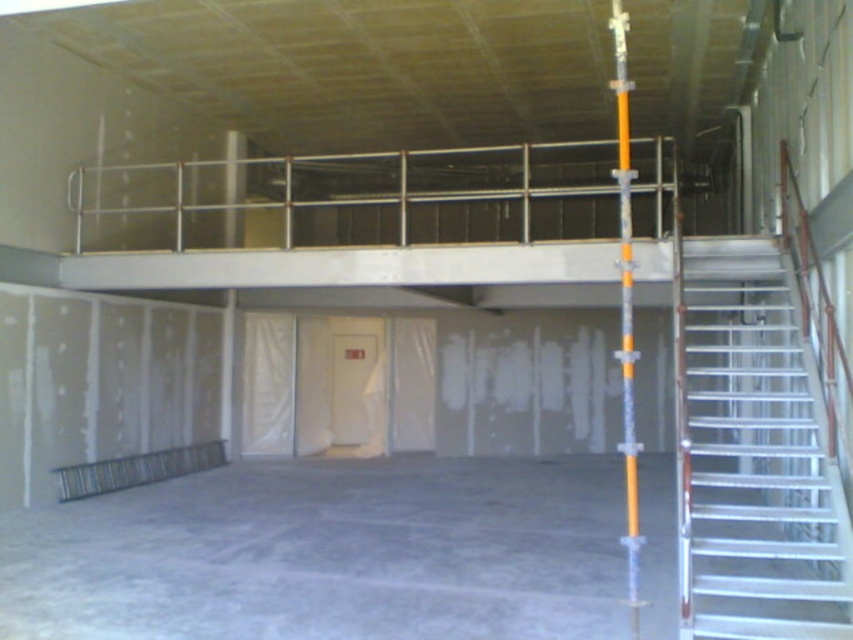
You are a construction worker carrying a heavy tool box and need to reach the second floor. You see the metallic silver staircase at right and the orange metallic pole at right. Which one should you use to climb safely?

You should use the metallic silver staircase at right to climb safely because it is positioned on the right side of the orange metallic pole at right, indicating it is designed for safe ascent, while the orange metallic pole is likely a support structure not meant for climbing.

You are standing at the origin point in the construction site. The point at coordinate (751,456) is marked. What object is located at that coordinate?

The point at coordinate (751,456) corresponds to the metallic silver staircase at right.